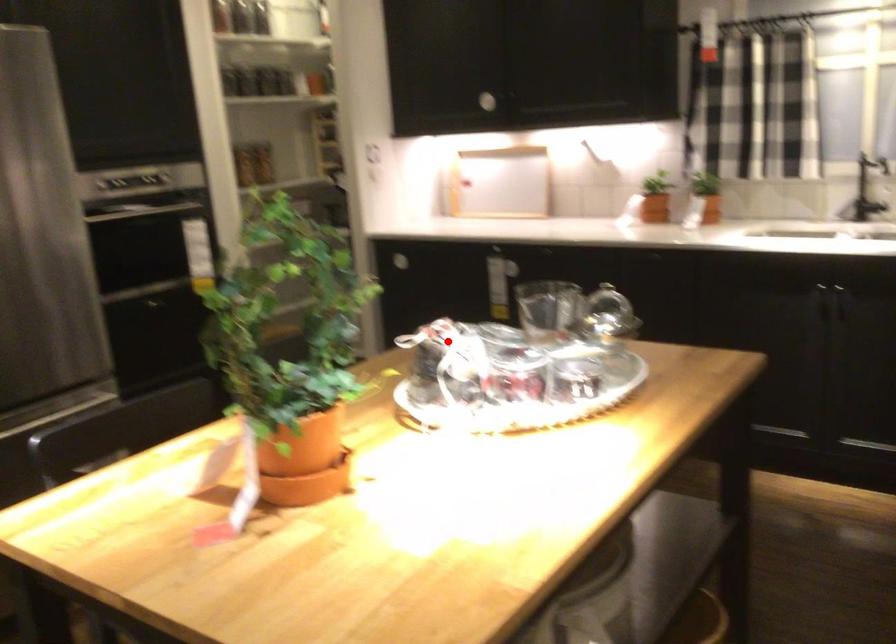
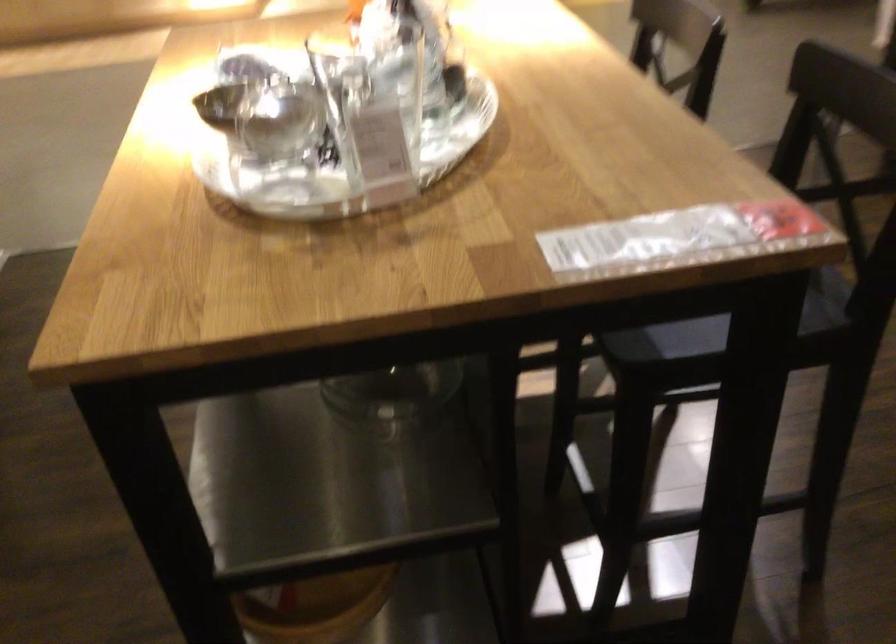
Question: I am providing you with two images of the same scene from different viewpoints. Given a red point in image1, look at the same physical point in image2. Is it:

Choices:
 (A) Closer to the viewpoint
 (B) Farther from the viewpoint

Answer: (A)